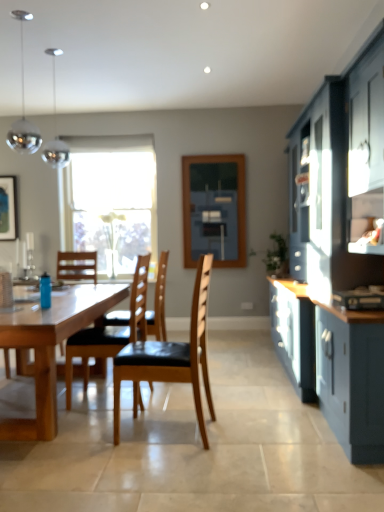
Identify the location of empty space that is ontop of satin chrome pendant lights at upper left (from a real-world perspective). The image size is (384, 512). (51, 51).